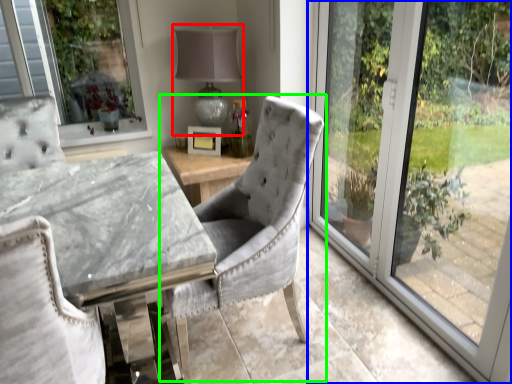
Question: Estimate the real-world distances between objects in this image. Which object is closer to table lamp (highlighted by a red box), window (highlighted by a blue box) or chair (highlighted by a green box)?

Choices:
 (A) window
 (B) chair

Answer: (A)